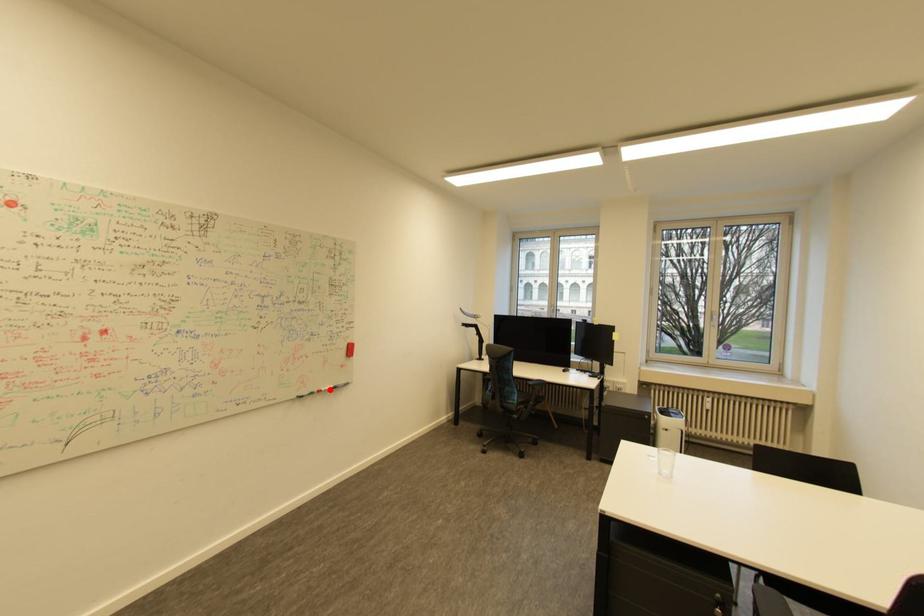
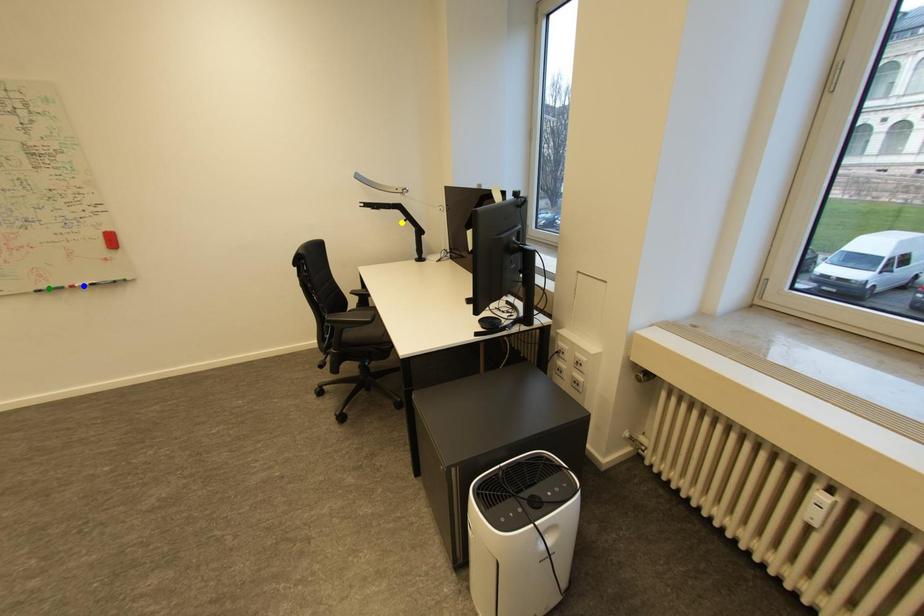
Question: I am providing you with two images of the same scene from different viewpoints. A red point is marked on the first image. You are given multiple points on the second image. Which mark in image 2 goes with the point in image 1?

Choices:
 (A) green point
 (B) blue point
 (C) yellow point

Answer: (B)